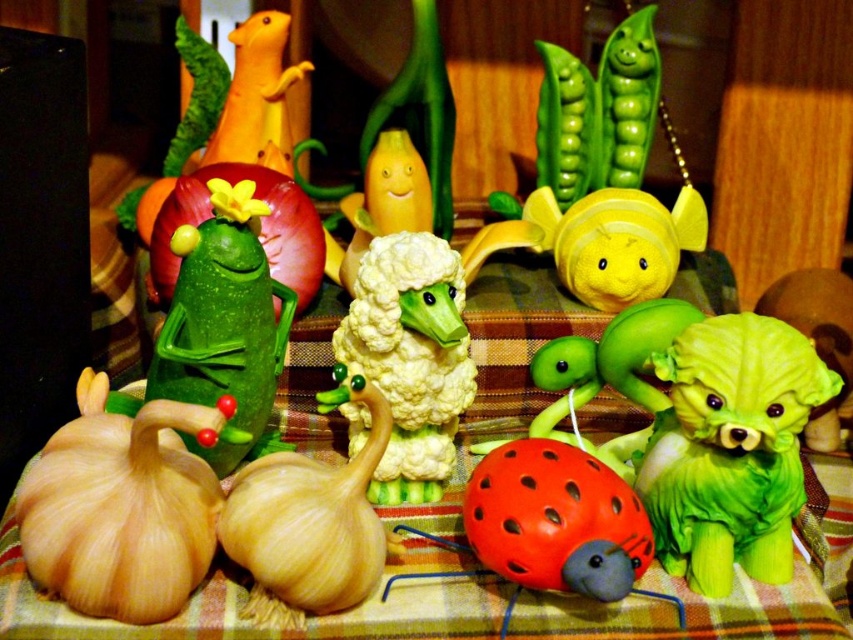
Question: Which object is positioned closest to the matte yellow rubber mouse at upper center?

Choices:
 (A) green rubber bear at center
 (B) smooth beige garlic at center
 (C) rubber ladybug at center

Answer: (B)

Question: Does green matte cucumber at center have a greater width compared to yellow fabric snail at center?

Choices:
 (A) no
 (B) yes

Answer: (A)

Question: Is white cauliflower at center wider than green matte cucumber at center?

Choices:
 (A) no
 (B) yes

Answer: (A)

Question: Is rubber ladybug at center above smooth beige garlic at center?

Choices:
 (A) yes
 (B) no

Answer: (B)

Question: Considering the real-world distances, which object is closest to the smooth beige garlic at center?

Choices:
 (A) yellow fabric snail at center
 (B) green rubber bear at center
 (C) smooth beige garlic at lower left

Answer: (C)

Question: Which object is positioned farthest from the yellow fabric snail at center?

Choices:
 (A) green rubber bear at center
 (B) green matte cucumber at center
 (C) matte yellow rubber mouse at upper center

Answer: (C)